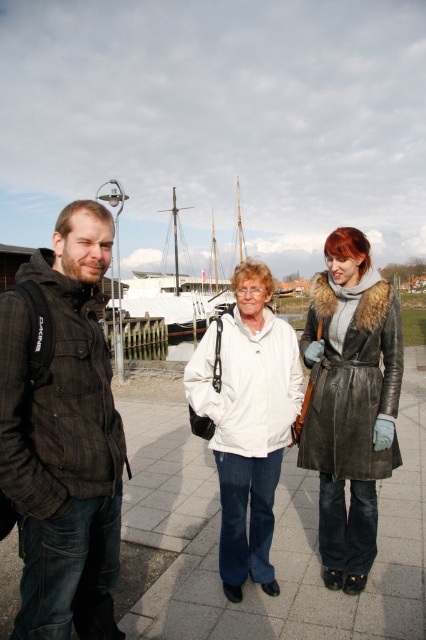
From the picture: You are a photographer setting up a shoot near the waterfront. You notice two jackets in the scene described. The dark brown plaid jacket at left and the white matte jacket at center. Which jacket is positioned higher from the ground? Please answer based on their vertical placement in the image.

The dark brown plaid jacket at left is located above the white matte jacket at center, so the dark brown plaid jacket at left is higher up in the image.

Based on the scene description, where is the dark brown plaid jacket at left positioned in the image?

The dark brown plaid jacket at left is positioned at the 2D coordinates point (63, 436).

You are standing at the center of the paved area and want to hand a document to the person wearing the dark brown plaid jacket at left. In which direction should you move to reach them?

The dark brown plaid jacket at left is located at point (63,436), so you should move to the left to reach the person wearing it.